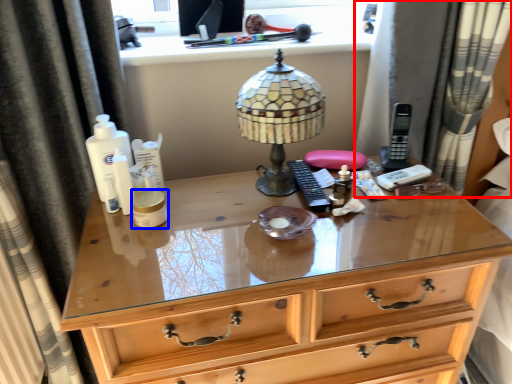
Question: Which point is closer to the camera, curtain (highlighted by a red box) or toiletry (highlighted by a blue box)?

Choices:
 (A) curtain
 (B) toiletry

Answer: (B)